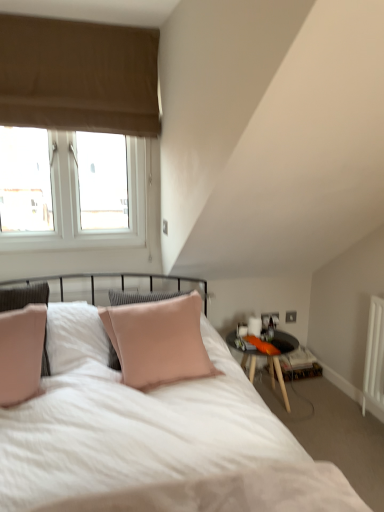
Question: Choose the correct answer: Is beige fabric window at upper left inside black glass table at right or outside it?

Choices:
 (A) inside
 (B) outside

Answer: (B)

Question: Considering the relative positions of beige fabric window at upper left and black glass table at right in the image provided, is beige fabric window at upper left to the left or to the right of black glass table at right?

Choices:
 (A) left
 (B) right

Answer: (A)

Question: Looking at the image, does beige fabric window at upper left seem bigger or smaller compared to black glass table at right?

Choices:
 (A) small
 (B) big

Answer: (B)

Question: From the image's perspective, is black glass table at right positioned above or below beige fabric window at upper left?

Choices:
 (A) above
 (B) below

Answer: (B)

Question: Does point (286, 395) appear closer or farther from the camera than point (9, 20)?

Choices:
 (A) closer
 (B) farther

Answer: (B)

Question: From a real-world perspective, is black glass table at right above or below beige fabric window at upper left?

Choices:
 (A) below
 (B) above

Answer: (A)

Question: In terms of height, does black glass table at right look taller or shorter compared to beige fabric window at upper left?

Choices:
 (A) tall
 (B) short

Answer: (B)